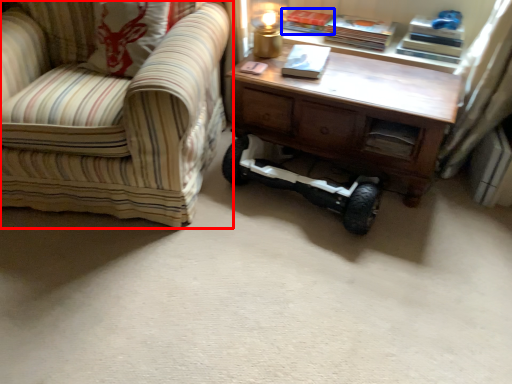
Question: Which object is further to the camera taking this photo, chair (highlighted by a red box) or book (highlighted by a blue box)?

Choices:
 (A) chair
 (B) book

Answer: (B)